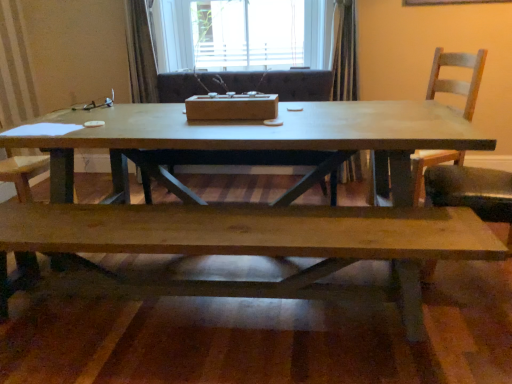
Question: Is matte wood coffee table at center at the back of wooden armchair at center?

Choices:
 (A) no
 (B) yes

Answer: (B)

Question: Does wooden armchair at center come behind matte wood coffee table at center?

Choices:
 (A) yes
 (B) no

Answer: (A)

Question: Are wooden armchair at center and matte wood coffee table at center far apart?

Choices:
 (A) no
 (B) yes

Answer: (A)

Question: Does wooden armchair at center come in front of matte wood coffee table at center?

Choices:
 (A) no
 (B) yes

Answer: (A)

Question: From the image's perspective, is wooden armchair at center under matte wood coffee table at center?

Choices:
 (A) no
 (B) yes

Answer: (A)

Question: Is matte wood coffee table at center a part of wooden armchair at center?

Choices:
 (A) yes
 (B) no

Answer: (B)

Question: Does wooden armchair at center lie behind natural wood bench at lower center?

Choices:
 (A) yes
 (B) no

Answer: (A)

Question: Considering the relative sizes of wooden armchair at center and natural wood bench at lower center in the image provided, is wooden armchair at center taller than natural wood bench at lower center?

Choices:
 (A) yes
 (B) no

Answer: (A)

Question: Is wooden armchair at center thinner than natural wood bench at lower center?

Choices:
 (A) no
 (B) yes

Answer: (A)

Question: Does wooden armchair at center have a smaller size compared to natural wood bench at lower center?

Choices:
 (A) yes
 (B) no

Answer: (B)

Question: Could natural wood bench at lower center be considered to be inside wooden armchair at center?

Choices:
 (A) no
 (B) yes

Answer: (A)

Question: Can you confirm if wooden armchair at center is bigger than natural wood bench at lower center?

Choices:
 (A) no
 (B) yes

Answer: (B)

Question: From the image's perspective, is matte wood coffee table at center on wooden armchair at center?

Choices:
 (A) no
 (B) yes

Answer: (A)